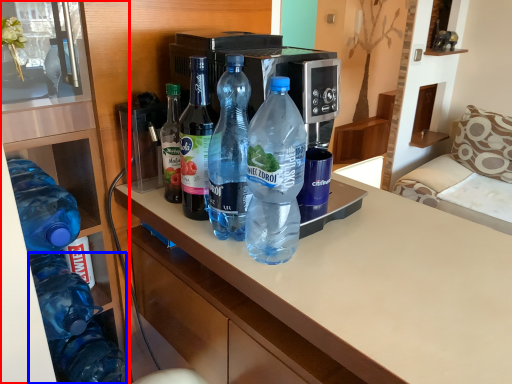
Question: Which point is closer to the camera, cabinetry (highlighted by a red box) or bottle (highlighted by a blue box)?

Choices:
 (A) cabinetry
 (B) bottle

Answer: (A)